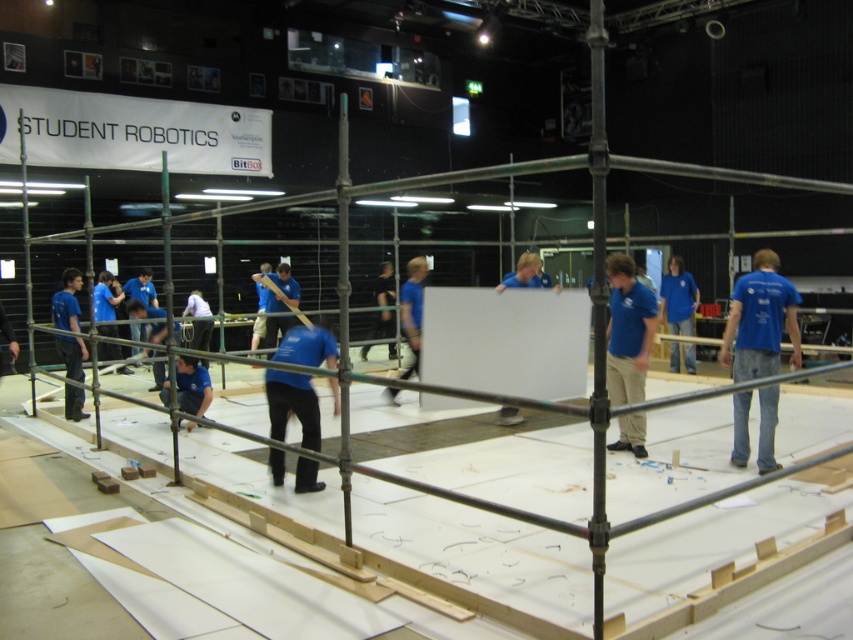
Can you confirm if matte blue shirt at lower left is shorter than blue shirt at center?

Yes, matte blue shirt at lower left is shorter than blue shirt at center.

Does matte blue shirt at lower left appear under blue shirt at center?

Indeed, matte blue shirt at lower left is positioned under blue shirt at center.

What do you see at coordinates (67, 301) in the screenshot? I see `matte blue shirt at lower left` at bounding box center [67, 301].

The height and width of the screenshot is (640, 853). What are the coordinates of `matte blue shirt at lower left` in the screenshot? It's located at tap(67, 301).

Is blue cotton shirt at center shorter than blue shirt at center?

Yes, blue cotton shirt at center is shorter than blue shirt at center.

Which is below, blue cotton shirt at center or blue shirt at center?

blue cotton shirt at center is lower down.

Who is more forward, (619, 269) or (660, 308)?

Point (619, 269) is more forward.

Locate an element on the screen. Image resolution: width=853 pixels, height=640 pixels. blue cotton shirt at center is located at coordinates (628, 332).

Between blue cotton shirt at center and matte blue shirt at lower left, which one is positioned lower?

matte blue shirt at lower left is lower down.

The image size is (853, 640). I want to click on blue cotton shirt at center, so click(x=628, y=332).

The width and height of the screenshot is (853, 640). I want to click on blue cotton shirt at center, so click(628, 332).